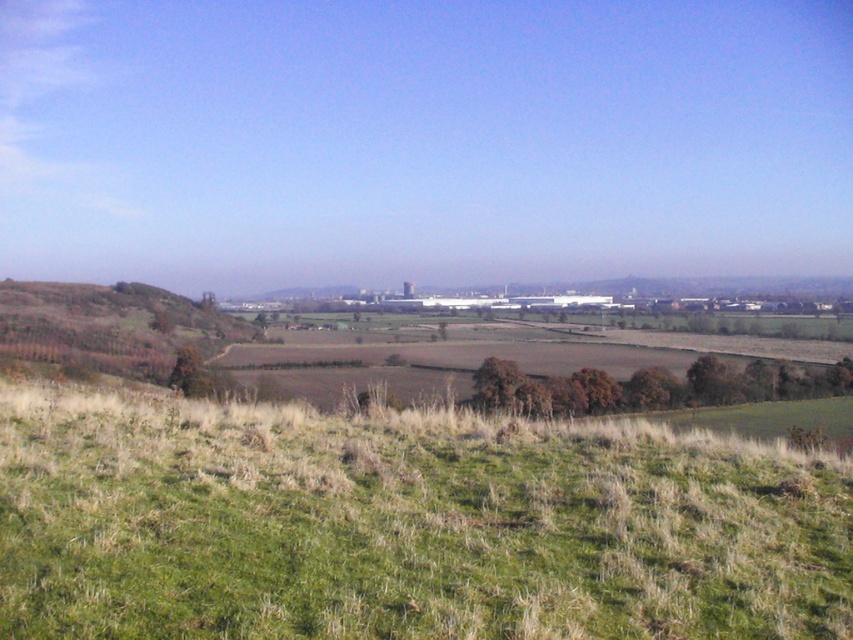
You are standing at the point labeled as point (405,524) in the image. Based on the scene description, what type of terrain are you currently standing on?

You are standing on the green grassy hillside at lower center.

You are standing at the base of the brown grassy hillside at left and want to walk to the green grassy hillside at lower center. Which direction should you head?

You should head to the right because the green grassy hillside at lower center is located to the right of the brown grassy hillside at left.

You are standing at the top of the grassy hill in the rural landscape. You see two points marked in the scene. The first point is at coordinates point (799, 486) and the second is at point (22, 320). Which point is closer to you?

Point (799, 486) is closer to the camera than point (22, 320).